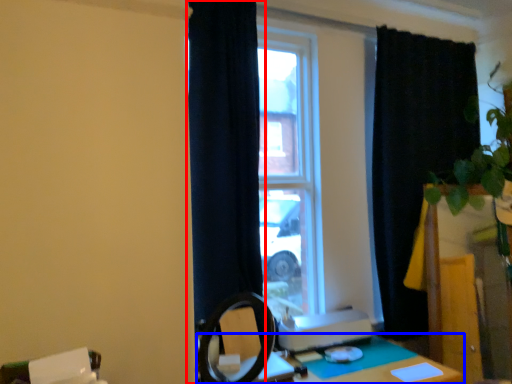
Question: Which object is closer to the camera taking this photo, curtain (highlighted by a red box) or table (highlighted by a blue box)?

Choices:
 (A) curtain
 (B) table

Answer: (B)